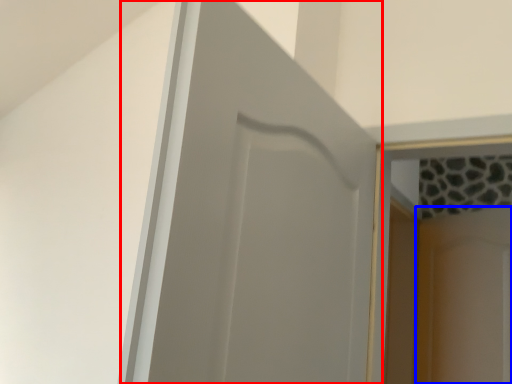
Question: Among these objects, which one is nearest to the camera, door (highlighted by a red box) or screen door (highlighted by a blue box)?

Choices:
 (A) door
 (B) screen door

Answer: (A)